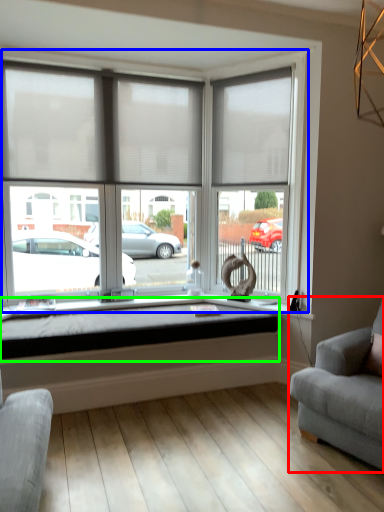
Question: Which is farther away from studio couch (highlighted by a red box)? window (highlighted by a blue box) or window sill (highlighted by a green box)?

Choices:
 (A) window
 (B) window sill

Answer: (A)